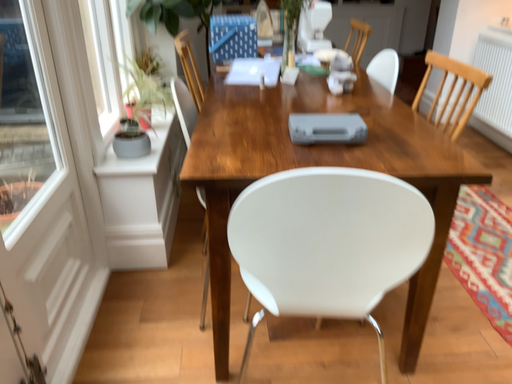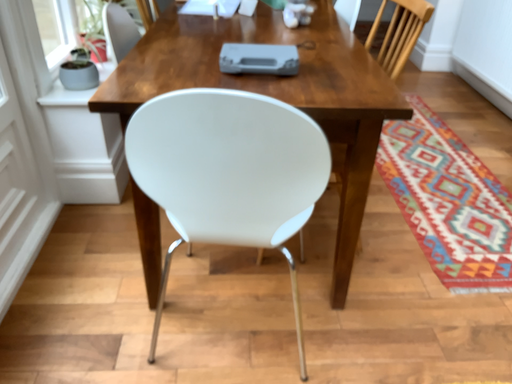
Question: How did the camera likely rotate when shooting the video?

Choices:
 (A) rotated upward
 (B) rotated downward

Answer: (B)